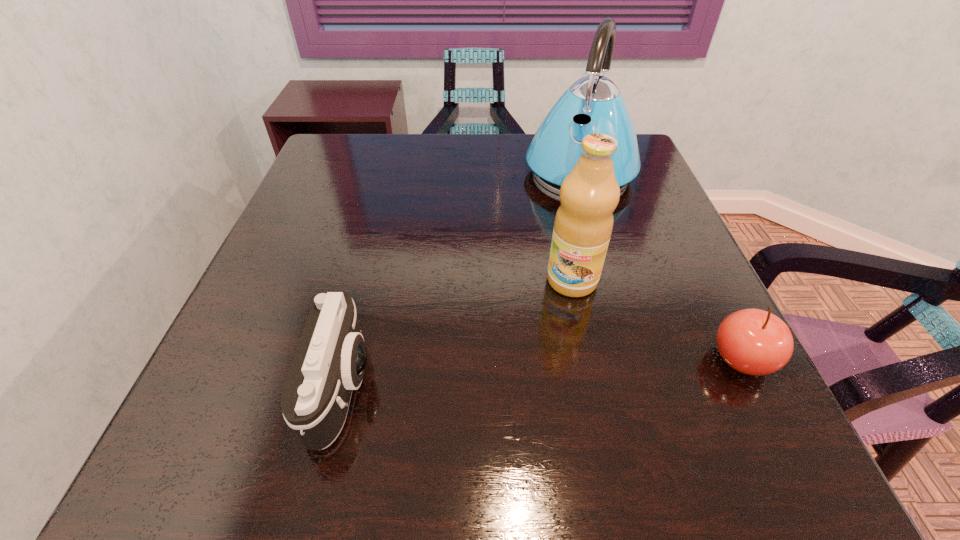
The width and height of the screenshot is (960, 540). In order to click on object that is positioned at the near right corner in this screenshot , I will do `click(755, 342)`.

Identify the location of vacant space at the far edge of the desktop. (473, 159).

Find the location of `free space at the near edge of the desktop`. free space at the near edge of the desktop is located at coordinates (552, 397).

The width and height of the screenshot is (960, 540). I want to click on free space at the left edge, so click(x=256, y=306).

Locate an element on the screen. The height and width of the screenshot is (540, 960). blank space at the right edge of the desktop is located at coordinates (612, 240).

This screenshot has width=960, height=540. Identify the location of free space at the far left corner of the desktop. (360, 174).

This screenshot has height=540, width=960. I want to click on free space at the near left corner of the desktop, so click(236, 403).

Identify the location of free space at the near right corner of the desktop. This screenshot has height=540, width=960. (741, 387).

Where is `empty location between the third shortest object and the camera`? Image resolution: width=960 pixels, height=540 pixels. empty location between the third shortest object and the camera is located at coordinates (458, 333).

Locate an element on the screen. The height and width of the screenshot is (540, 960). unoccupied area between the apple and the olive oil is located at coordinates (657, 320).